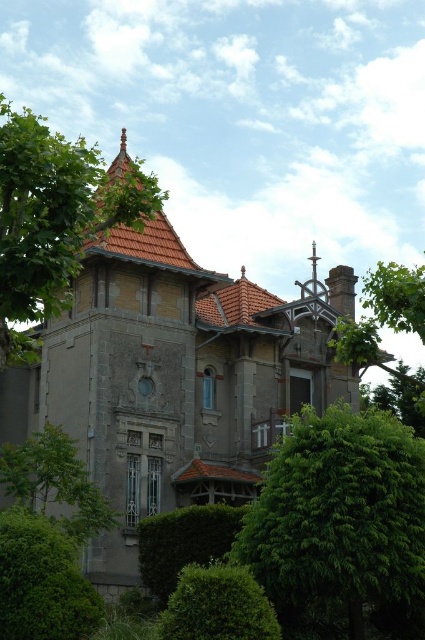
Question: Can you confirm if green leafy tree at left is thinner than green leafy bush at lower left?

Choices:
 (A) no
 (B) yes

Answer: (A)

Question: Which point is farther from the camera taking this photo?

Choices:
 (A) (39, 525)
 (B) (178, 637)

Answer: (A)

Question: Among these points, which one is farthest from the camera?

Choices:
 (A) (61, 541)
 (B) (244, 570)

Answer: (A)

Question: Does green leafy tree at left have a greater width compared to green leafy tree at right?

Choices:
 (A) no
 (B) yes

Answer: (B)

Question: Which point is closer to the camera?

Choices:
 (A) (418, 557)
 (B) (40, 547)
 (C) (235, 604)
 (D) (42, 460)

Answer: (C)

Question: Does green leafy tree at left come behind green leafy tree at right?

Choices:
 (A) yes
 (B) no

Answer: (B)